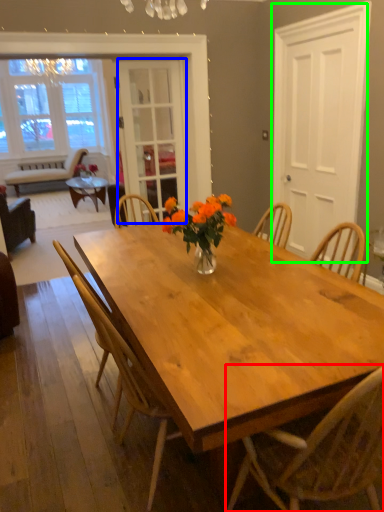
Question: Which object is the farthest from chair (highlighted by a red box)? Choose among these: screen door (highlighted by a blue box) or screen door (highlighted by a green box).

Choices:
 (A) screen door
 (B) screen door

Answer: (A)